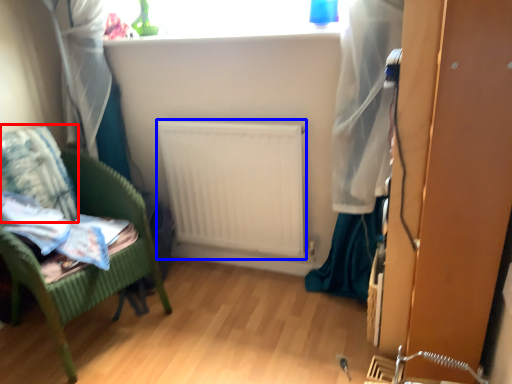
Question: Among these objects, which one is nearest to the camera, pillow (highlighted by a red box) or radiator (highlighted by a blue box)?

Choices:
 (A) pillow
 (B) radiator

Answer: (A)